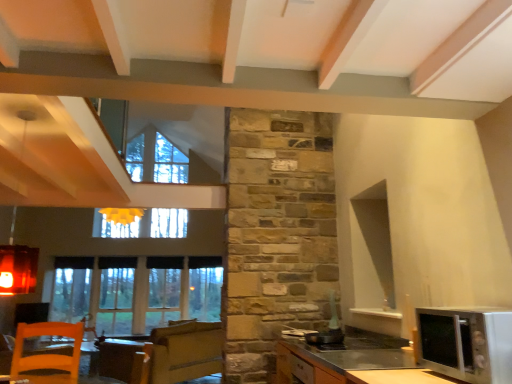
Question: Does silver metallic microwave at lower right have a larger size compared to clear glass window at lower left?

Choices:
 (A) yes
 (B) no

Answer: (B)

Question: Considering the relative sizes of silver metallic microwave at lower right and clear glass window at lower left in the image provided, is silver metallic microwave at lower right shorter than clear glass window at lower left?

Choices:
 (A) no
 (B) yes

Answer: (B)

Question: Is silver metallic microwave at lower right not close to clear glass window at lower left?

Choices:
 (A) yes
 (B) no

Answer: (A)

Question: From a real-world perspective, is silver metallic microwave at lower right located higher than clear glass window at lower left?

Choices:
 (A) no
 (B) yes

Answer: (A)

Question: Can you confirm if silver metallic microwave at lower right is thinner than clear glass window at lower left?

Choices:
 (A) no
 (B) yes

Answer: (A)

Question: From their relative heights in the image, would you say silver metallic microwave at lower right is taller or shorter than clear glass window at lower left?

Choices:
 (A) tall
 (B) short

Answer: (B)

Question: Considering the positions of silver metallic microwave at lower right and clear glass window at lower left in the image, is silver metallic microwave at lower right wider or thinner than clear glass window at lower left?

Choices:
 (A) wide
 (B) thin

Answer: (A)

Question: From the image's perspective, is silver metallic microwave at lower right above or below clear glass window at lower left?

Choices:
 (A) below
 (B) above

Answer: (B)

Question: Is point (510, 350) closer or farther from the camera than point (156, 316)?

Choices:
 (A) closer
 (B) farther

Answer: (A)

Question: Based on their sizes in the image, would you say orange wooden chair at lower left is bigger or smaller than clear glass window at lower left?

Choices:
 (A) small
 (B) big

Answer: (B)

Question: Considering their positions, is orange wooden chair at lower left located in front of or behind clear glass window at lower left?

Choices:
 (A) behind
 (B) front

Answer: (B)

Question: From the image's perspective, is orange wooden chair at lower left located above or below clear glass window at lower left?

Choices:
 (A) above
 (B) below

Answer: (A)

Question: Is orange wooden chair at lower left situated inside clear glass window at lower left or outside?

Choices:
 (A) inside
 (B) outside

Answer: (B)

Question: Based on their sizes in the image, would you say clear glass window at lower left is bigger or smaller than silver metallic microwave at lower right?

Choices:
 (A) small
 (B) big

Answer: (B)

Question: Based on their positions, is clear glass window at lower left located to the left or right of silver metallic microwave at lower right?

Choices:
 (A) left
 (B) right

Answer: (A)